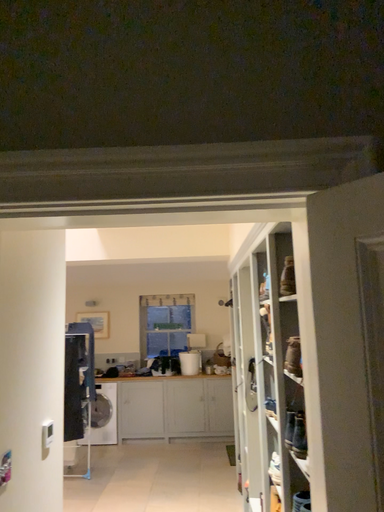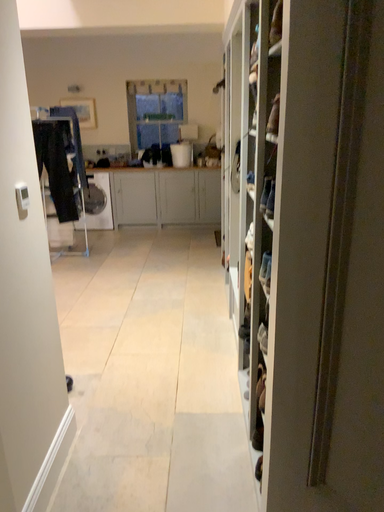
Question: How did the camera likely rotate when shooting the video?

Choices:
 (A) rotated downward
 (B) rotated upward

Answer: (A)